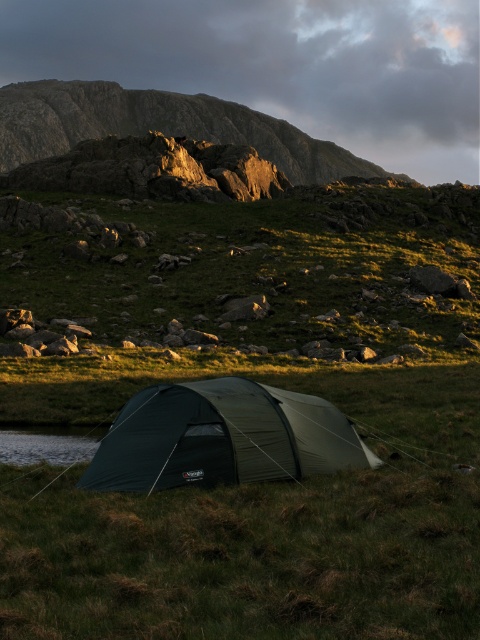
Question: Which of the following is the closest to the observer?

Choices:
 (A) green fabric tent at center
 (B) rugged stone hillside at upper center

Answer: (A)

Question: Among these points, which one is nearest to the camera?

Choices:
 (A) (284, 397)
 (B) (255, 134)

Answer: (A)

Question: In this image, where is green fabric tent at center located relative to rugged stone hillside at upper center?

Choices:
 (A) right
 (B) left

Answer: (A)

Question: Can you confirm if green fabric tent at center is bigger than rugged stone hillside at upper center?

Choices:
 (A) no
 (B) yes

Answer: (A)

Question: Is green fabric tent at center above rugged stone hillside at upper center?

Choices:
 (A) yes
 (B) no

Answer: (B)

Question: Which point appears closest to the camera in this image?

Choices:
 (A) (171, 456)
 (B) (50, 120)

Answer: (A)